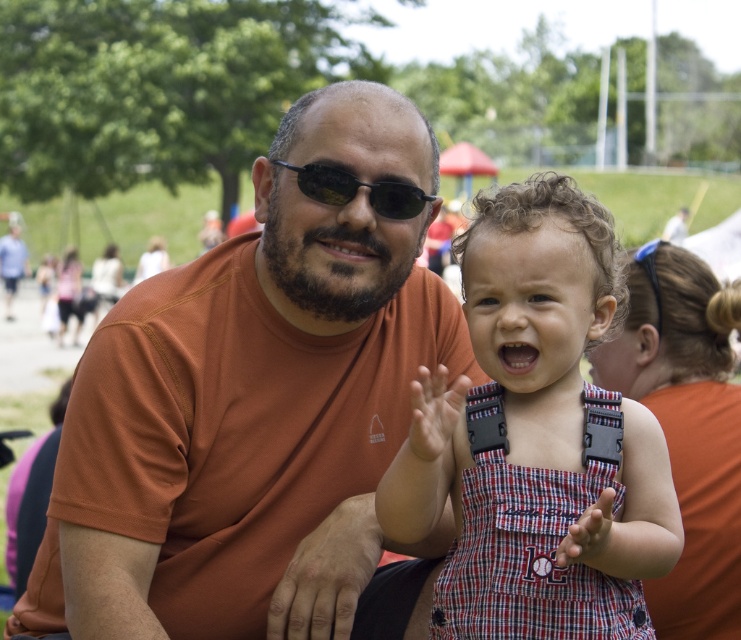
Does plaid fabric overalls at center have a lesser width compared to black plastic sunglasses at center?

Incorrect, plaid fabric overalls at center's width is not less than black plastic sunglasses at center's.

Does point (494, 285) lie behind point (342, 202)?

No, (494, 285) is closer to viewer.

Identify the location of plaid fabric overalls at center. (536, 436).

Does orange t-shirt at center have a larger size compared to black plastic sunglasses at center?

Correct, orange t-shirt at center is larger in size than black plastic sunglasses at center.

Based on the photo, which is more to the left, orange t-shirt at center or black plastic sunglasses at center?

From the viewer's perspective, orange t-shirt at center appears more on the left side.

Does point (122, 349) come closer to viewer compared to point (379, 195)?

No, (122, 349) is further to viewer.

You are a GUI agent. You are given a task and a screenshot of the screen. Output one action in this format:
    pyautogui.click(x=<x>, y=<y>)
    Task: Click on the orange t-shirt at center
    
    Given the screenshot: What is the action you would take?
    pyautogui.click(x=252, y=404)

Is orange t-shirt at center bigger than plaid fabric overalls at center?

Yes, orange t-shirt at center is bigger than plaid fabric overalls at center.

In the scene shown: Is orange t-shirt at center thinner than plaid fabric overalls at center?

In fact, orange t-shirt at center might be wider than plaid fabric overalls at center.

Identify the location of orange t-shirt at center. (252, 404).

This screenshot has width=741, height=640. I want to click on orange t-shirt at center, so click(x=252, y=404).